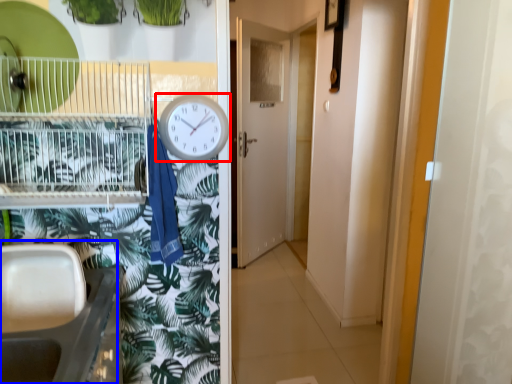
Question: Which object appears closest to the camera in this image, clock (highlighted by a red box) or sink (highlighted by a blue box)?

Choices:
 (A) clock
 (B) sink

Answer: (B)